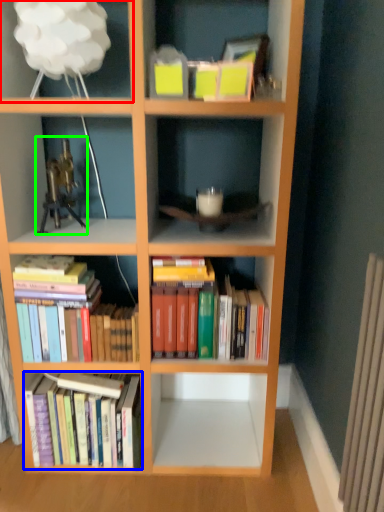
Question: Considering the real-world distances, which object is farthest from shelf (highlighted by a red box)? book (highlighted by a blue box) or toy (highlighted by a green box)?

Choices:
 (A) book
 (B) toy

Answer: (A)